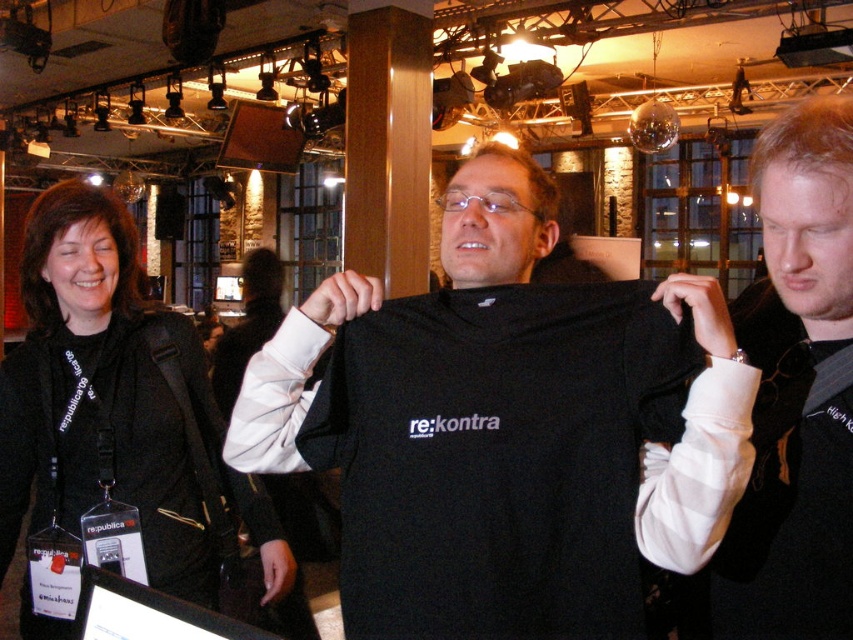
Question: Which point appears farthest from the camera in this image?

Choices:
 (A) (525, 433)
 (B) (843, 316)

Answer: (A)

Question: Which point is closer to the camera taking this photo?

Choices:
 (A) (776, 154)
 (B) (180, 556)
 (C) (437, 580)

Answer: (A)

Question: Can you confirm if black fabric jacket at upper left is positioned above black fabric shirt at center?

Choices:
 (A) no
 (B) yes

Answer: (A)

Question: Can you confirm if black fabric t-shirt at center is positioned to the left of black fabric jacket at upper left?

Choices:
 (A) yes
 (B) no

Answer: (B)

Question: Which point appears farthest from the camera in this image?

Choices:
 (A) (753, 625)
 (B) (109, 356)
 (C) (428, 304)

Answer: (B)

Question: Can you confirm if black fabric t-shirt at center is positioned to the left of black fabric jacket at upper left?

Choices:
 (A) yes
 (B) no

Answer: (B)